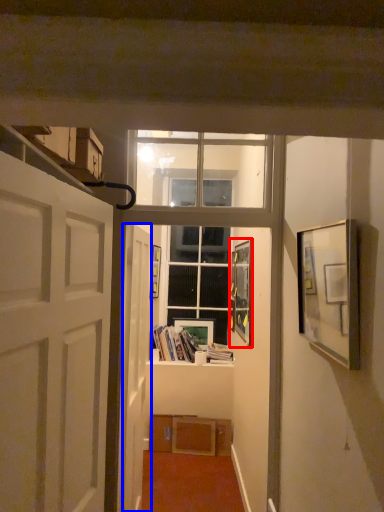
Question: Which point is closer to the camera, picture frame (highlighted by a red box) or door (highlighted by a blue box)?

Choices:
 (A) picture frame
 (B) door

Answer: (B)